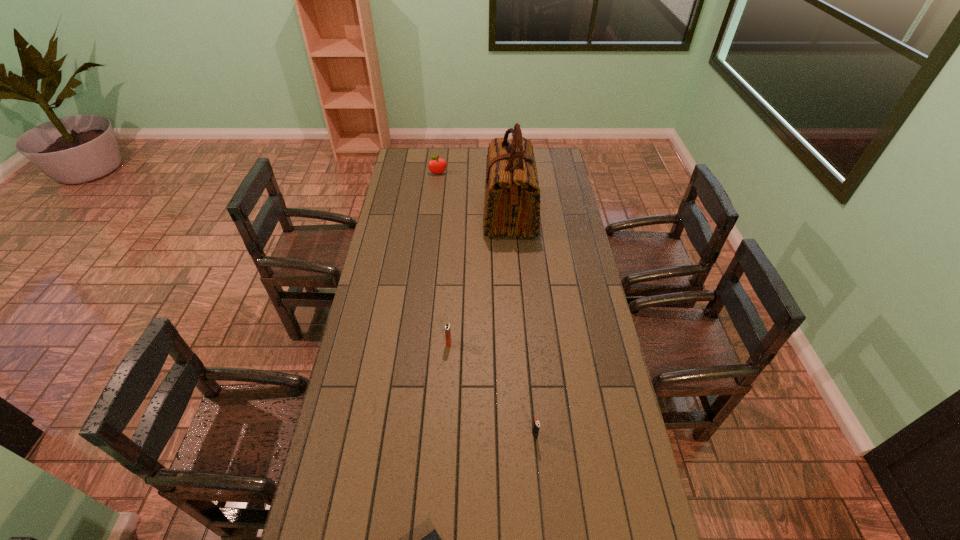
Where is `free spot between the second farthest object and the apple`? The width and height of the screenshot is (960, 540). free spot between the second farthest object and the apple is located at coordinates (474, 194).

Locate an element on the screen. The height and width of the screenshot is (540, 960). object that is the third closest to the third farthest object is located at coordinates (432, 539).

Identify which object is the second closest to the shopping bag. Please provide its 2D coordinates. Your answer should be formatted as a tuple, i.e. [(x, y)], where the tuple contains the x and y coordinates of a point satisfying the conditions above.

[(447, 327)]

Locate an element on the screen. The image size is (960, 540). vacant space that satisfies the following two spatial constraints: 1. on the open handle side of the tallest object; 2. on the back side of the right igniter is located at coordinates (527, 435).